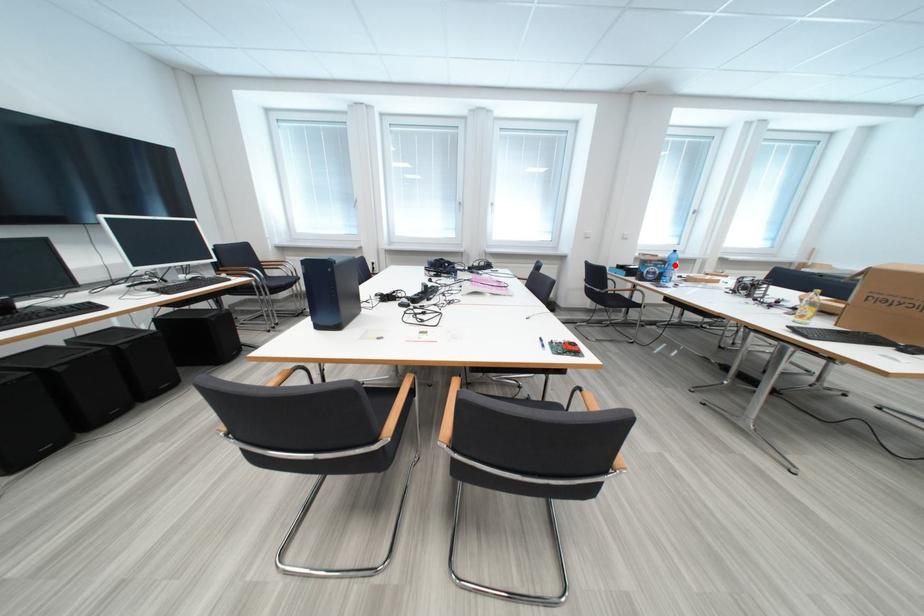
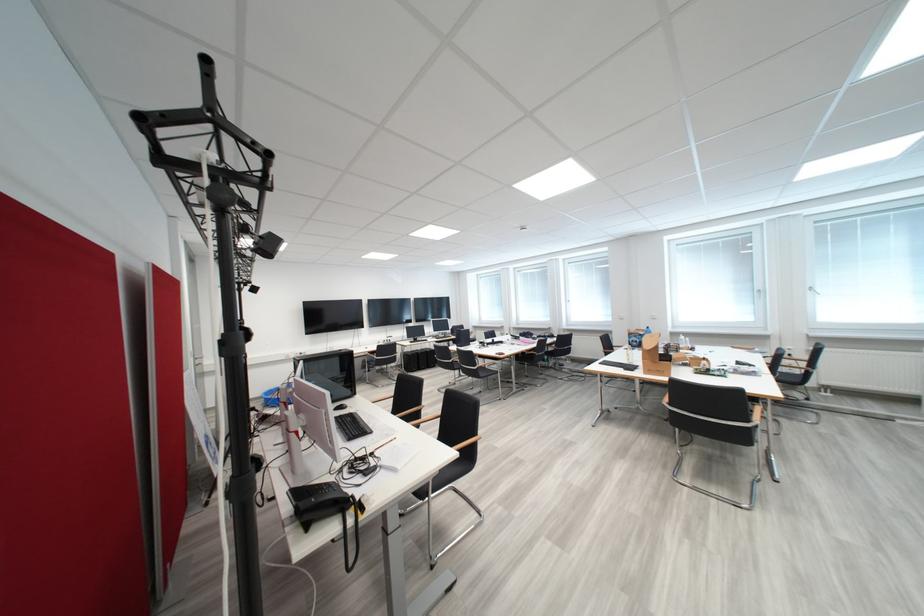
The point at the highlighted location is marked in the first image. Where is the corresponding point in the second image?

(650, 337)